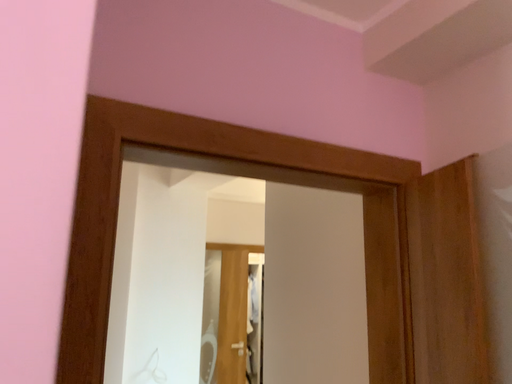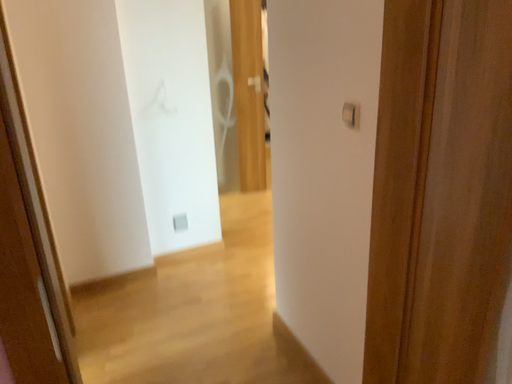
Question: Which way did the camera rotate in the video?

Choices:
 (A) rotated downward
 (B) rotated upward

Answer: (A)